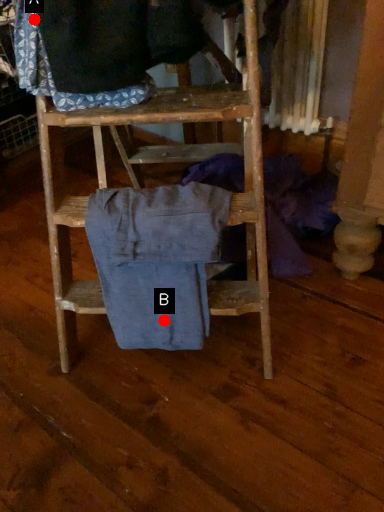
Question: Two points are circled on the image, labeled by A and B beside each circle. Among these points, which one is nearest to the camera?

Choices:
 (A) A is closer
 (B) B is closer

Answer: (A)